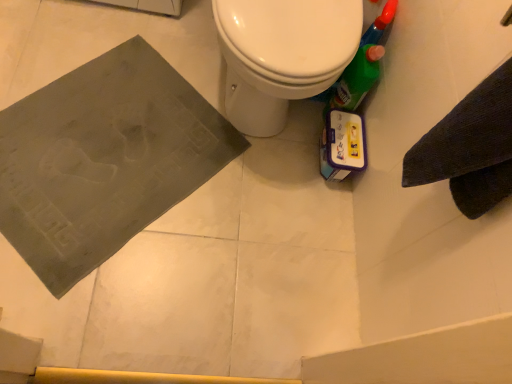
Locate an element on the screen. free space behind dark gray rubber mat at lower left is located at coordinates (167, 41).